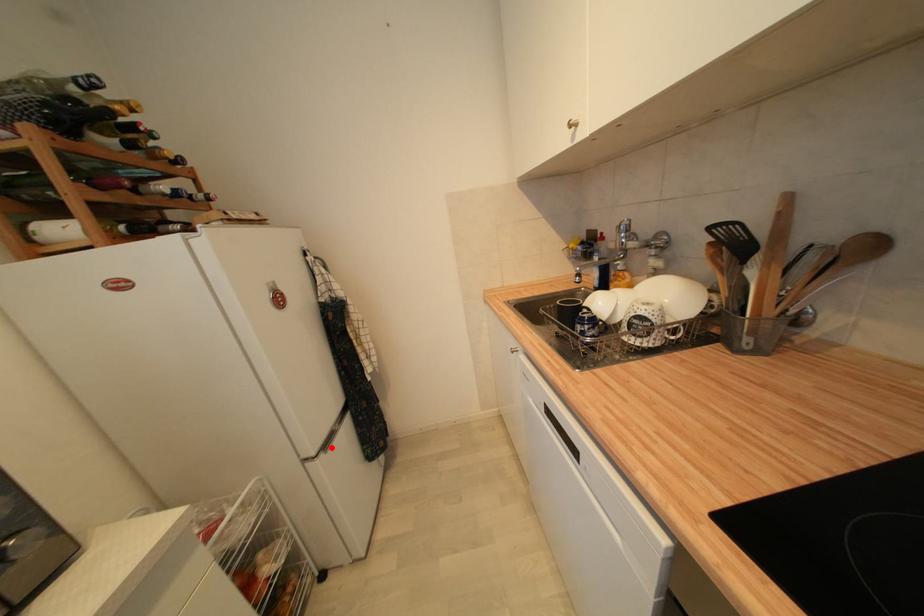
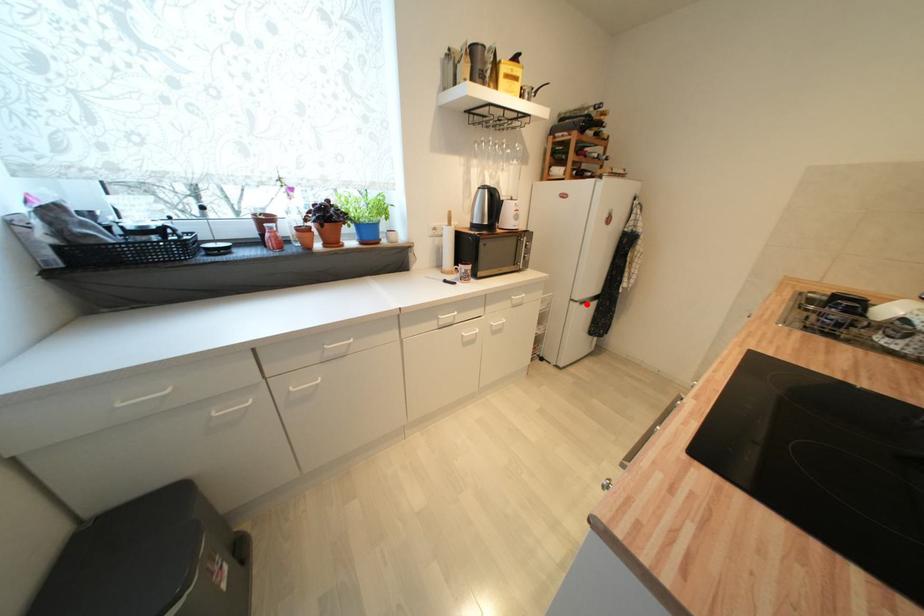
I am providing you with two images of the same scene from different viewpoints. A red point is marked on the first image and another point is marked on the second image. Do the highlighted points in image1 and image2 indicate the same real-world spot?

Yes